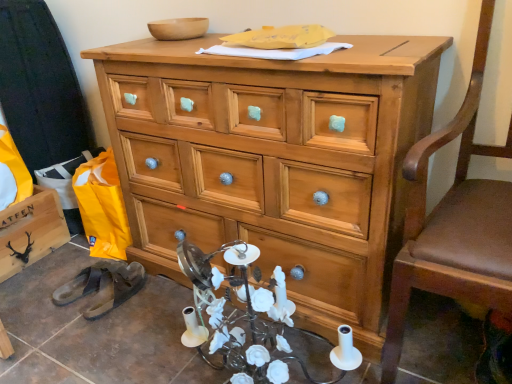
Identify the location of vacant area located to the right-hand side of black rubber sandals at lower left. This screenshot has height=384, width=512. (159, 297).